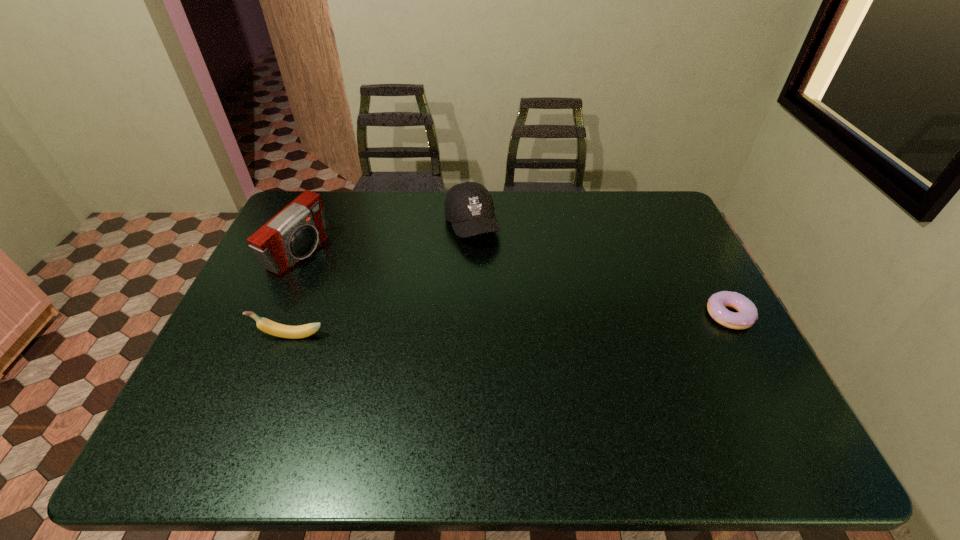
Find the location of a particular element. vacant space on the desktop that is between the banana and the shortest object and is positioned on the front-facing side of the baseball cap is located at coordinates (516, 325).

Locate an element on the screen. The image size is (960, 540). free space on the desktop that is between the banana and the doughnut and is positioned on the front-facing side of the tallest object is located at coordinates (462, 327).